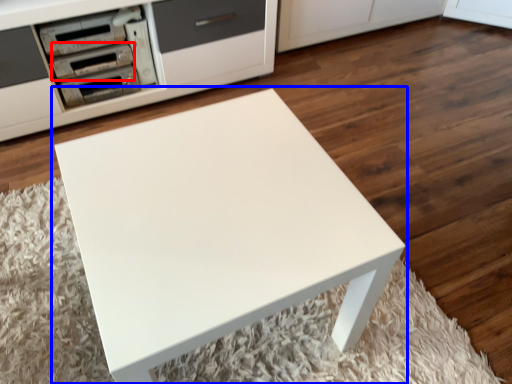
Question: Which object is further to the camera taking this photo, appliance (highlighted by a red box) or table (highlighted by a blue box)?

Choices:
 (A) appliance
 (B) table

Answer: (A)